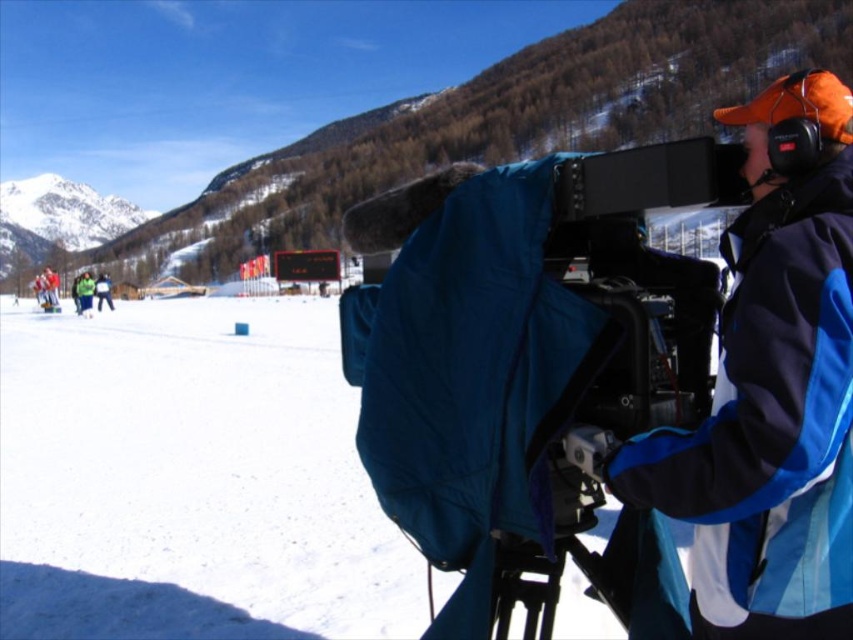
Is blue fabric-covered video camera at right thinner than green reflective jacket at lower left?

No.

Is point (404, 456) in front of point (90, 301)?

That is True.

Identify the location of blue fabric-covered video camera at right. (531, 372).

Is point (766, 602) positioned before point (100, 273)?

Yes.

Identify the location of blue softshell jacket at right. This screenshot has width=853, height=640. (769, 428).

Does point (735, 269) come closer to viewer compared to point (109, 307)?

Yes, it is in front of point (109, 307).

Where is `blue softshell jacket at right`? Image resolution: width=853 pixels, height=640 pixels. blue softshell jacket at right is located at coordinates (769, 428).

How distant is blue fabric-covered video camera at right from green fabric jacket at lower left?

blue fabric-covered video camera at right and green fabric jacket at lower left are 145.20 meters apart.

Between blue fabric-covered video camera at right and green fabric jacket at lower left, which one appears on the left side from the viewer's perspective?

From the viewer's perspective, green fabric jacket at lower left appears more on the left side.

Which is in front, point (550, 262) or point (109, 289)?

Point (550, 262) is more forward.

Locate an element on the screen. The image size is (853, 640). blue fabric-covered video camera at right is located at coordinates (531, 372).